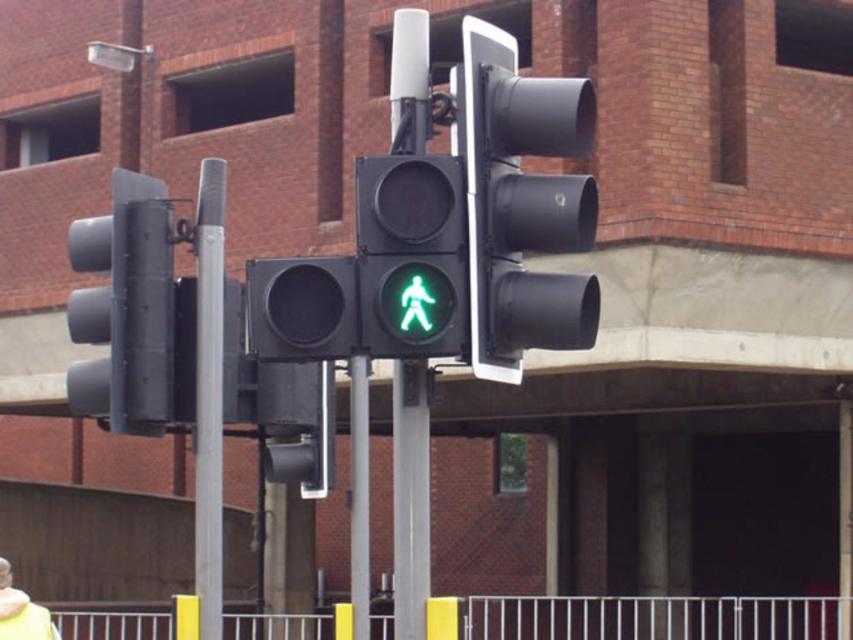
Question: Does matte black traffic light at left appear on the left side of green matte pedestrian signal at center?

Choices:
 (A) yes
 (B) no

Answer: (A)

Question: From the image, what is the correct spatial relationship of green matte pedestrian signal at center in relation to yellow woolen jacket at lower left?

Choices:
 (A) above
 (B) below

Answer: (A)

Question: Does matte black traffic light at left have a smaller size compared to yellow woolen jacket at lower left?

Choices:
 (A) yes
 (B) no

Answer: (B)

Question: Which object is farther from the camera taking this photo?

Choices:
 (A) yellow woolen jacket at lower left
 (B) green matte pedestrian signal at center

Answer: (A)

Question: Which point is farther from the camera taking this photo?

Choices:
 (A) pyautogui.click(x=480, y=314)
 (B) pyautogui.click(x=207, y=285)
 (C) pyautogui.click(x=151, y=371)
 (D) pyautogui.click(x=393, y=321)

Answer: (B)

Question: Which point appears closest to the camera in this image?

Choices:
 (A) (194, 588)
 (B) (407, 340)

Answer: (B)